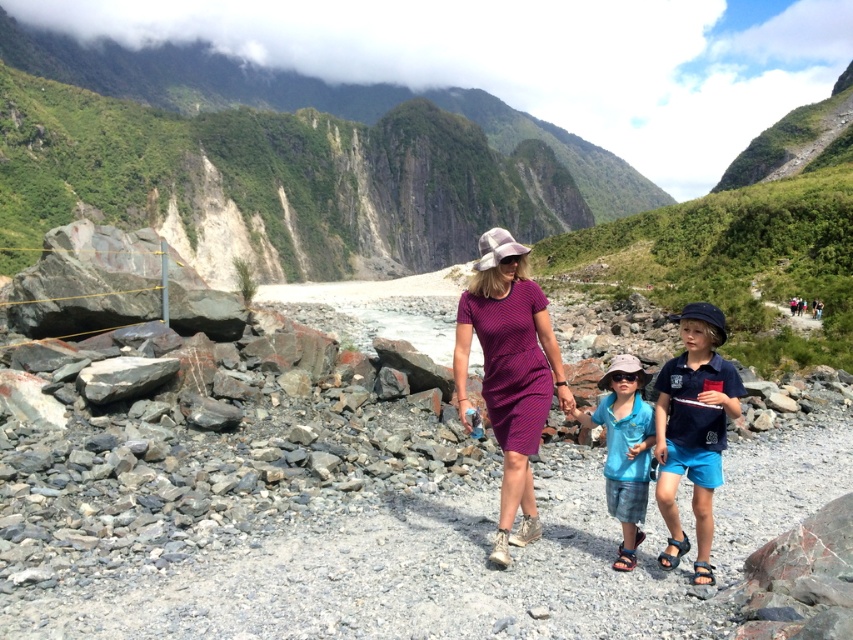
Find the location of a particular element. This screenshot has height=640, width=853. blue cotton shirt at center is located at coordinates (693, 429).

Does blue cotton shirt at center lie in front of blue fabric shorts at center?

Yes, it is.

Is point (724, 410) less distant than point (627, 460)?

Yes, it is in front of point (627, 460).

The height and width of the screenshot is (640, 853). I want to click on blue cotton shirt at center, so click(693, 429).

Who is more distant from viewer, (x=157, y=154) or (x=677, y=358)?

The point (x=157, y=154) is more distant.

Which is more to the right, green rock at upper center or blue cotton shirt at center?

blue cotton shirt at center is more to the right.

Is point (228, 182) behind point (695, 419)?

Yes.

This screenshot has width=853, height=640. Find the location of `green rock at upper center`. green rock at upper center is located at coordinates (280, 161).

From the picture: Who is shorter, green rock at upper center or purple striped dress at center?

purple striped dress at center is shorter.

Does point (505, 156) lie behind point (535, 413)?

Yes, point (505, 156) is farther from viewer.

Measure the distance between point (x=33, y=51) and camera.

They are 235.17 meters apart.

Find the location of `green rock at upper center`. green rock at upper center is located at coordinates (280, 161).